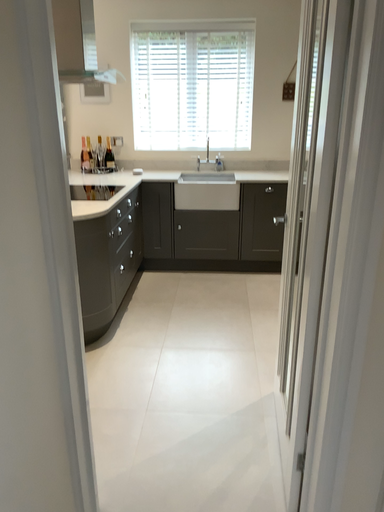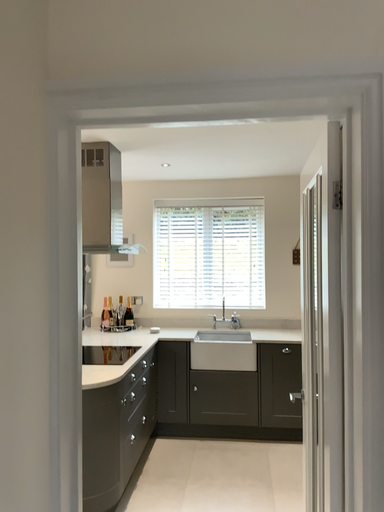
Question: How did the camera likely rotate when shooting the video?

Choices:
 (A) rotated downward
 (B) rotated upward

Answer: (B)